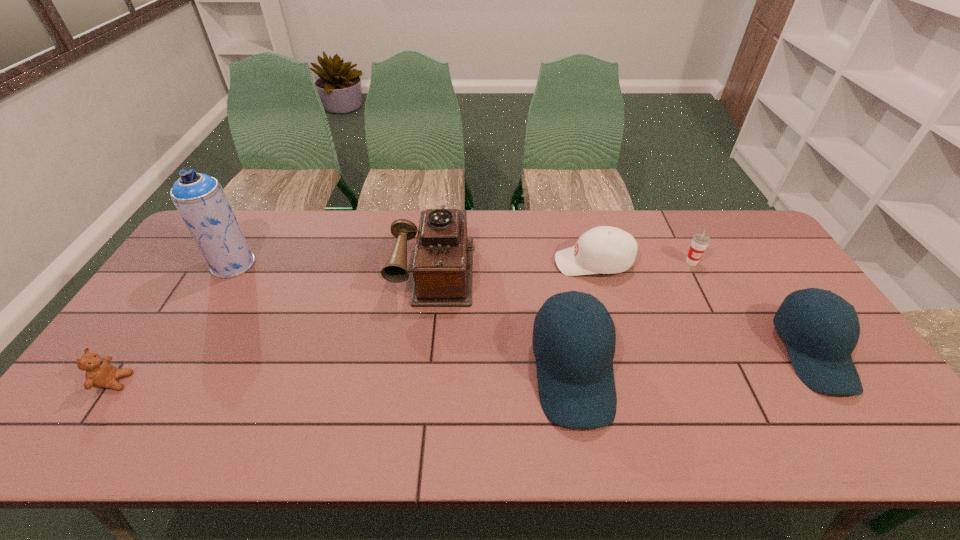
Find the location of a particular element. This screenshot has width=960, height=540. vacant area located 0.260m on the side of the cup with the logo is located at coordinates (728, 332).

In order to click on vacant space located on the horn of the phonograph_record in this screenshot , I will do `click(421, 382)`.

You are a GUI agent. You are given a task and a screenshot of the screen. Output one action in this format:
    pyautogui.click(x=<x>, y=<y>)
    Task: Click on the free space located 0.300m on the front-facing side of the shortest baseball cap
    This screenshot has height=540, width=960.
    Given the screenshot: What is the action you would take?
    pyautogui.click(x=461, y=262)

The height and width of the screenshot is (540, 960). I want to click on free space located on the front-facing side of the shortest baseball cap, so click(x=492, y=262).

The image size is (960, 540). Find the location of `vacant space located 0.070m on the front-facing side of the shortest baseball cap`. vacant space located 0.070m on the front-facing side of the shortest baseball cap is located at coordinates (533, 262).

Image resolution: width=960 pixels, height=540 pixels. Identify the location of free space located on the face of the leftmost object. click(x=267, y=382).

Find the location of `aerosol can that is at the far edge`. aerosol can that is at the far edge is located at coordinates (199, 198).

The image size is (960, 540). Identify the location of phonograph_record situated at the far edge. (442, 269).

Locate an element on the screen. The width and height of the screenshot is (960, 540). baseball cap that is at the far edge is located at coordinates (607, 250).

Where is `teddy bear situated at the near edge`? Image resolution: width=960 pixels, height=540 pixels. teddy bear situated at the near edge is located at coordinates (100, 373).